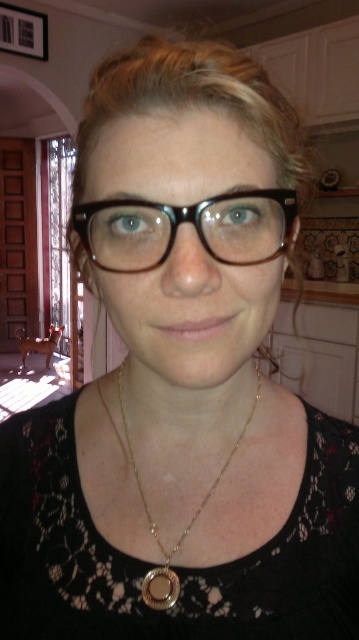
Question: Does black plastic glasses at center come in front of gold chain at center?

Choices:
 (A) yes
 (B) no

Answer: (A)

Question: Which of the following is the closest to the observer?

Choices:
 (A) (174, 592)
 (B) (81, 225)

Answer: (B)

Question: From the image, what is the correct spatial relationship of black plastic glasses at center in relation to gold chain at center?

Choices:
 (A) below
 (B) above

Answer: (B)

Question: Does black plastic glasses at center have a larger size compared to gold chain at center?

Choices:
 (A) no
 (B) yes

Answer: (A)

Question: Which point is farther to the camera?

Choices:
 (A) (174, 602)
 (B) (212, 205)

Answer: (A)